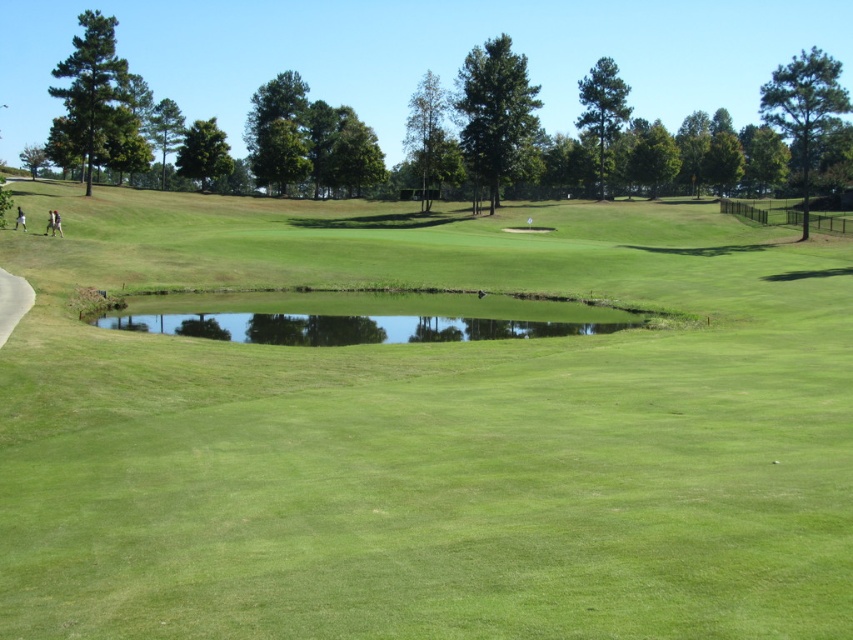
Question: Can you confirm if green grassy field at center is bigger than green grassy pond at center?

Choices:
 (A) yes
 (B) no

Answer: (A)

Question: Does green grassy field at center appear on the left side of green grassy pond at center?

Choices:
 (A) yes
 (B) no

Answer: (B)

Question: Which object appears closest to the camera in this image?

Choices:
 (A) green grassy pond at center
 (B) green grassy field at center

Answer: (B)

Question: Which object appears farthest from the camera in this image?

Choices:
 (A) green grassy pond at center
 (B) green grassy field at center

Answer: (A)

Question: Can you confirm if green grassy field at center is wider than green grassy pond at center?

Choices:
 (A) no
 (B) yes

Answer: (B)